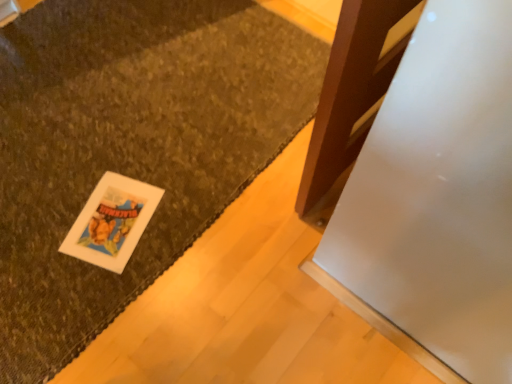
Where is `free space above textured brown mat at lower left (from a real-world perspective)`? Image resolution: width=512 pixels, height=384 pixels. free space above textured brown mat at lower left (from a real-world perspective) is located at coordinates (92, 132).